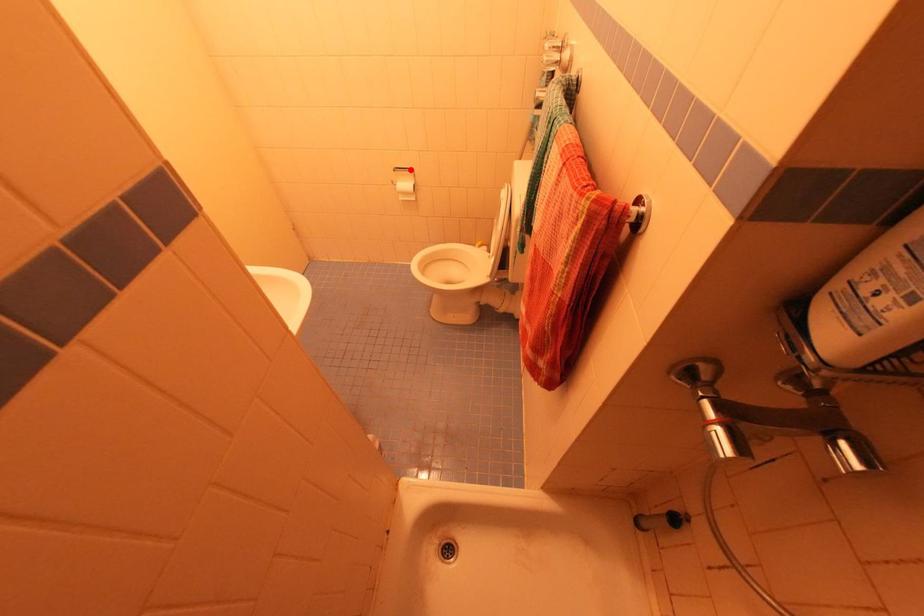
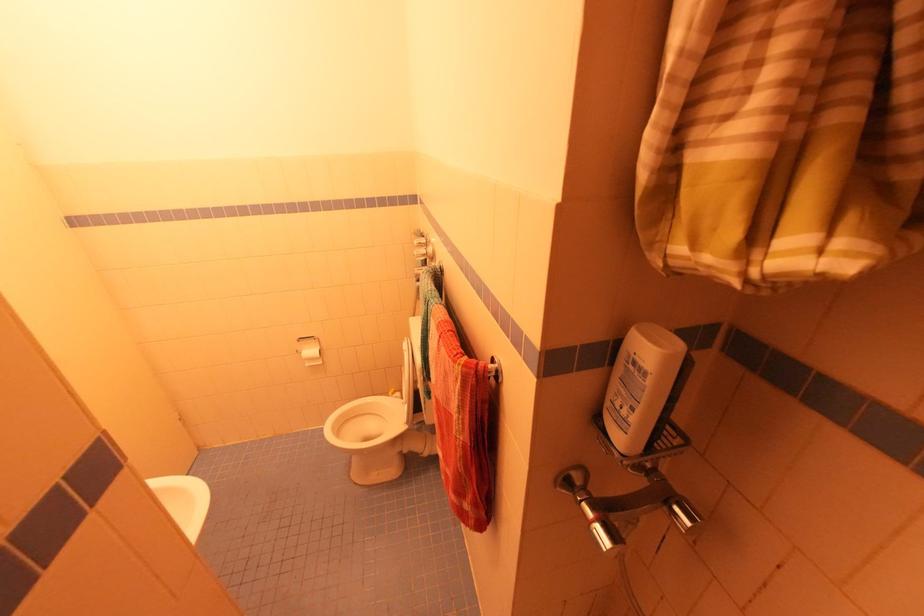
Question: I am providing you with two images of the same scene from different viewpoints. A red point is shown in image1. For the corresponding object point in image2, is it positioned nearer or farther from the camera?

Choices:
 (A) Nearer
 (B) Farther

Answer: (B)